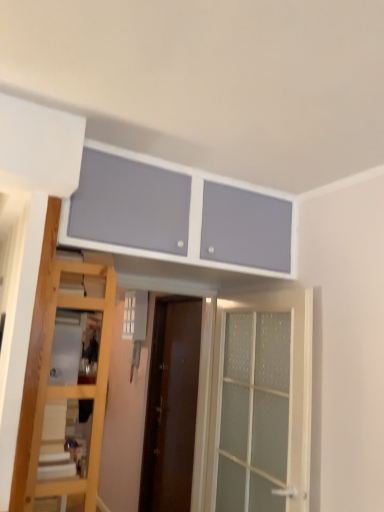
Question: Is clear glass door at center, which is counted as the 2th door, starting from the left, inside matte white cabinet at upper center?

Choices:
 (A) no
 (B) yes

Answer: (A)

Question: Is matte white cabinet at upper center in contact with clear glass door at center, arranged as the first door when viewed from the front?

Choices:
 (A) no
 (B) yes

Answer: (A)

Question: Are matte white cabinet at upper center and clear glass door at center, the 1th door viewed from the right, located far from each other?

Choices:
 (A) yes
 (B) no

Answer: (B)

Question: Is matte white cabinet at upper center aimed at clear glass door at center, arranged as the first door when viewed from the front?

Choices:
 (A) no
 (B) yes

Answer: (A)

Question: Can you confirm if matte white cabinet at upper center is smaller than clear glass door at center, the second door positioned from the back?

Choices:
 (A) no
 (B) yes

Answer: (A)

Question: Considering the positions of clear glass door at center, the second door positioned from the back, and wooden ladder at lower left in the image, is clear glass door at center, the second door positioned from the back, bigger or smaller than wooden ladder at lower left?

Choices:
 (A) big
 (B) small

Answer: (A)

Question: Is clear glass door at center, the 1th door viewed from the right, wider or thinner than wooden ladder at lower left?

Choices:
 (A) wide
 (B) thin

Answer: (B)

Question: Considering the relative positions of clear glass door at center, the second door positioned from the back, and wooden ladder at lower left in the image provided, is clear glass door at center, the second door positioned from the back, to the left or to the right of wooden ladder at lower left?

Choices:
 (A) left
 (B) right

Answer: (B)

Question: From the image's perspective, relative to wooden ladder at lower left, is clear glass door at center, the 1th door viewed from the right, above or below?

Choices:
 (A) below
 (B) above

Answer: (A)

Question: Looking at their shapes, would you say clear glass door at center, arranged as the first door when viewed from the front, is wider or thinner than matte white cabinet at upper center?

Choices:
 (A) thin
 (B) wide

Answer: (A)

Question: Does point (296, 448) appear closer or farther from the camera than point (193, 200)?

Choices:
 (A) farther
 (B) closer

Answer: (B)

Question: From the image's perspective, is clear glass door at center, the 1th door viewed from the right, positioned above or below matte white cabinet at upper center?

Choices:
 (A) below
 (B) above

Answer: (A)

Question: From a real-world perspective, relative to matte white cabinet at upper center, is clear glass door at center, the 1th door viewed from the right, vertically above or below?

Choices:
 (A) above
 (B) below

Answer: (B)

Question: From a real-world perspective, is clear glass door at center, the 1th door viewed from the right, positioned above or below brown wooden door at center, positioned as the second door in front-to-back order?

Choices:
 (A) above
 (B) below

Answer: (A)

Question: Is point (281, 304) closer or farther from the camera than point (178, 368)?

Choices:
 (A) farther
 (B) closer

Answer: (B)